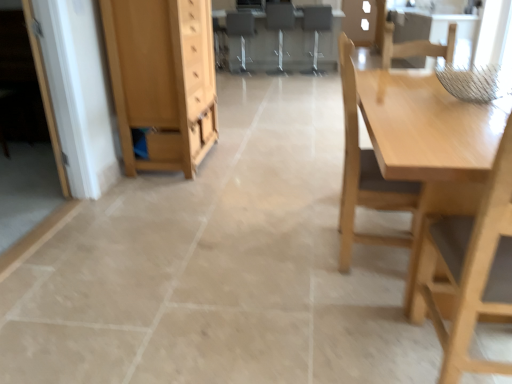
How much space does metallic silver chair at center, positioned as the 4th chair in front-to-back order, occupy vertically?

metallic silver chair at center, positioned as the 4th chair in front-to-back order, is 1.04 meters tall.

The width and height of the screenshot is (512, 384). What do you see at coordinates (162, 78) in the screenshot?
I see `light wood cabinet at left` at bounding box center [162, 78].

Describe the element at coordinates (316, 30) in the screenshot. I see `wooden chair at center, which is the fourth chair in left-to-right order` at that location.

Find the location of a particular element. The image size is (512, 384). wooden chair at center, which is the second chair in right-to-left order is located at coordinates (316, 30).

Locate an element on the screen. matte wood drawer at center is located at coordinates (207, 125).

Is point (207, 131) closer or farther from the camera than point (484, 197)?

Point (207, 131) is farther from the camera than point (484, 197).

Is matte wood drawer at center far away from light wood chair at right, which is the third chair in left-to-right order?

That's right, there is a large distance between matte wood drawer at center and light wood chair at right, which is the third chair in left-to-right order.

Considering the sizes of objects matte wood drawer at center and light wood chair at right, the 5th chair in the back-to-front sequence, in the image provided, who is thinner, matte wood drawer at center or light wood chair at right, the 5th chair in the back-to-front sequence,?

Thinner between the two is matte wood drawer at center.

Is metallic silver chair at center, which ranks as the 2th chair in back-to-front order, thinner than light wood cabinet at left?

Yes.

Is point (274, 27) closer or farther from the camera than point (125, 106)?

Point (274, 27) appears to be farther away from the viewer than point (125, 106).

Is metallic silver chair at center, the second chair viewed from the left, further to camera compared to light wood cabinet at left?

Yes, metallic silver chair at center, the second chair viewed from the left, is behind light wood cabinet at left.

Starting from the light wood cabinet at left, which chair is the 3rd one behind? Please provide its 2D coordinates.

[(279, 28)]

Is light brown wooden chair at upper right, the second chair positioned from the front, to the right of light wood table at right from the viewer's perspective?

Indeed, light brown wooden chair at upper right, the second chair positioned from the front, is positioned on the right side of light wood table at right.

From the image's perspective, is light brown wooden chair at upper right, the second chair positioned from the front, located above or below light wood table at right?

Based on their image positions, light brown wooden chair at upper right, the second chair positioned from the front, is located above light wood table at right.

How many degrees apart are the facing directions of light brown wooden chair at upper right, the second chair positioned from the front, and light wood table at right?

The angle between the facing direction of light brown wooden chair at upper right, the second chair positioned from the front, and the facing direction of light wood table at right is 180 degrees.

What's the angular difference between metallic gray chair at center, the first chair from the left, and wooden chair at center, which is the 3th chair from back to front,'s facing directions?

The angle between the facing direction of metallic gray chair at center, the first chair from the left, and the facing direction of wooden chair at center, which is the 3th chair from back to front, is 4.52 degrees.

Is metallic gray chair at center, which is the 1th chair in back-to-front order, at the left side of wooden chair at center, which is the second chair in right-to-left order?

Yes.

Could you tell me if metallic gray chair at center, positioned as the fifth chair in front-to-back order, is turned towards wooden chair at center, which is the second chair in right-to-left order?

No, metallic gray chair at center, positioned as the fifth chair in front-to-back order, is not facing towards wooden chair at center, which is the second chair in right-to-left order.

Who is more distant, metallic gray chair at center, positioned as the fifth chair in front-to-back order, or wooden chair at center, which is the 3th chair from front to back?

metallic gray chair at center, positioned as the fifth chair in front-to-back order, is behind.

Is point (418, 54) behind point (174, 100)?

That is False.

Consider the image. Can you see light brown wooden chair at upper right, which ranks as the 1th chair in right-to-left order, touching light wood cabinet at left?

There is a gap between light brown wooden chair at upper right, which ranks as the 1th chair in right-to-left order, and light wood cabinet at left.

Considering the relative sizes of light brown wooden chair at upper right, positioned as the fourth chair in back-to-front order, and light wood cabinet at left in the image provided, is light brown wooden chair at upper right, positioned as the fourth chair in back-to-front order, wider than light wood cabinet at left?

Correct, the width of light brown wooden chair at upper right, positioned as the fourth chair in back-to-front order, exceeds that of light wood cabinet at left.

Which object is closer to the camera taking this photo, light brown wooden chair at upper right, positioned as the fourth chair in back-to-front order, or light wood cabinet at left?

light wood cabinet at left is more forward.

Is white glossy door at left oriented away from wooden chair at center, which is the 3th chair from back to front?

white glossy door at left is not turned away from wooden chair at center, which is the 3th chair from back to front.

Is white glossy door at left inside or outside of wooden chair at center, which is the 3th chair from back to front?

white glossy door at left cannot be found inside wooden chair at center, which is the 3th chair from back to front.

Based on the photo, from a real-world perspective, is white glossy door at left over wooden chair at center, which is the 3th chair from back to front?

Yes, from a real-world perspective, white glossy door at left is above wooden chair at center, which is the 3th chair from back to front.

Based on the photo, is white glossy door at left at the right side of wooden chair at center, which is the 3th chair from back to front?

In fact, white glossy door at left is to the left of wooden chair at center, which is the 3th chair from back to front.

Who is more distant, wooden chair at center, which is the 3th chair from front to back, or light brown wooden chair at upper right, the second chair positioned from the front?

wooden chair at center, which is the 3th chair from front to back, is further from the camera.

From the image's perspective, is wooden chair at center, which is the fourth chair in left-to-right order, above or below light brown wooden chair at upper right, acting as the fifth chair starting from the left?

wooden chair at center, which is the fourth chair in left-to-right order, is below light brown wooden chair at upper right, acting as the fifth chair starting from the left.

Is wooden chair at center, which is the second chair in right-to-left order, oriented towards light brown wooden chair at upper right, which ranks as the 1th chair in right-to-left order?

No.

Which object is positioned more to the left, wooden chair at center, which is the second chair in right-to-left order, or light brown wooden chair at upper right, positioned as the fourth chair in back-to-front order?

wooden chair at center, which is the second chair in right-to-left order, is more to the left.

Where is `the 3rd chair counting from the right side of the matte wood drawer at center`? the 3rd chair counting from the right side of the matte wood drawer at center is located at coordinates (472, 269).

In order to click on chair that is the 3rd one when counting upward from the light wood cabinet at left (from the image's perspective) in this screenshot , I will do `click(279, 28)`.

When comparing their distances from wooden chair at center, which is the 3th chair from back to front, does metallic silver chair at center, positioned as the 4th chair in front-to-back order, or matte wood drawer at center seem closer?

metallic silver chair at center, positioned as the 4th chair in front-to-back order, is closer to wooden chair at center, which is the 3th chair from back to front.

When comparing their distances from light wood table at right, does matte gray computer desk at center or metallic silver chair at center, positioned as the 4th chair in front-to-back order, seem further?

The object further to light wood table at right is metallic silver chair at center, positioned as the 4th chair in front-to-back order.

Considering their positions, is metallic silver chair at center, positioned as the 4th chair in front-to-back order, positioned further to light wood chair at right, the 5th chair in the back-to-front sequence, than matte wood drawer at center?

metallic silver chair at center, positioned as the 4th chair in front-to-back order.

Looking at the image, which one is located further to matte gray computer desk at center, light brown wooden chair at upper right, which ranks as the 1th chair in right-to-left order, or light wood chair at right, the 5th chair in the back-to-front sequence?

light wood chair at right, the 5th chair in the back-to-front sequence, is positioned further to the anchor matte gray computer desk at center.

From the image, which object appears to be nearer to matte gray computer desk at center, light brown wooden chair at upper right, positioned as the fourth chair in back-to-front order, or metallic gray chair at center, which is the 1th chair in back-to-front order?

metallic gray chair at center, which is the 1th chair in back-to-front order, lies closer to matte gray computer desk at center than the other object.

Consider the image. When comparing their distances from light wood chair at right, the first chair viewed from the front, does wooden chair at center, which is the second chair in right-to-left order, or white glossy door at left seem further?

wooden chair at center, which is the second chair in right-to-left order, is further to light wood chair at right, the first chair viewed from the front.

Considering their positions, is light wood cabinet at left positioned closer to light brown wooden chair at upper right, positioned as the fourth chair in back-to-front order, than metallic silver chair at center, which is counted as the fourth chair, starting from the right?

light wood cabinet at left.

Considering their positions, is light wood cabinet at left positioned closer to metallic gray chair at center, the first chair from the left, than light wood chair at right, the first chair viewed from the front?

Among the two, light wood cabinet at left is located nearer to metallic gray chair at center, the first chair from the left.

In order to click on computer desk between metallic gray chair at center, positioned as the fifth chair in front-to-back order, and wooden chair at center, which is the 3th chair from back to front in this screenshot , I will do `click(279, 45)`.

The width and height of the screenshot is (512, 384). Find the location of `chair between light wood table at right and wooden chair at center, which is the fourth chair in left-to-right order, along the z-axis`. chair between light wood table at right and wooden chair at center, which is the fourth chair in left-to-right order, along the z-axis is located at coordinates (415, 46).

Where is `table positioned between light wood chair at right, the third chair from the right, and light brown wooden chair at upper right, the second chair positioned from the front, from near to far`? The height and width of the screenshot is (384, 512). table positioned between light wood chair at right, the third chair from the right, and light brown wooden chair at upper right, the second chair positioned from the front, from near to far is located at coordinates (426, 152).

Locate an element on the screen. The width and height of the screenshot is (512, 384). drawer between white glossy door at left and matte gray computer desk at center from front to back is located at coordinates (207, 125).